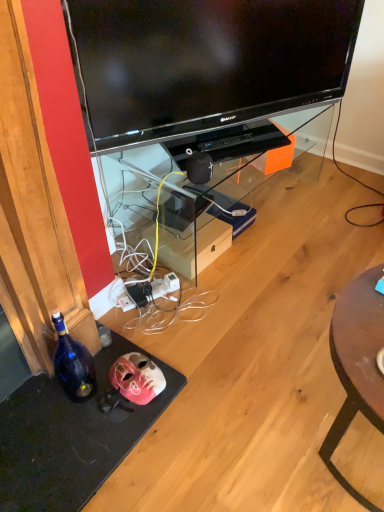
This screenshot has width=384, height=512. Describe the element at coordinates (241, 178) in the screenshot. I see `transparent glass entertainment center at center` at that location.

Where is `transparent glass entertainment center at center`? Image resolution: width=384 pixels, height=512 pixels. transparent glass entertainment center at center is located at coordinates (241, 178).

Where is `transparent glass entertainment center at center`? The image size is (384, 512). transparent glass entertainment center at center is located at coordinates (241, 178).